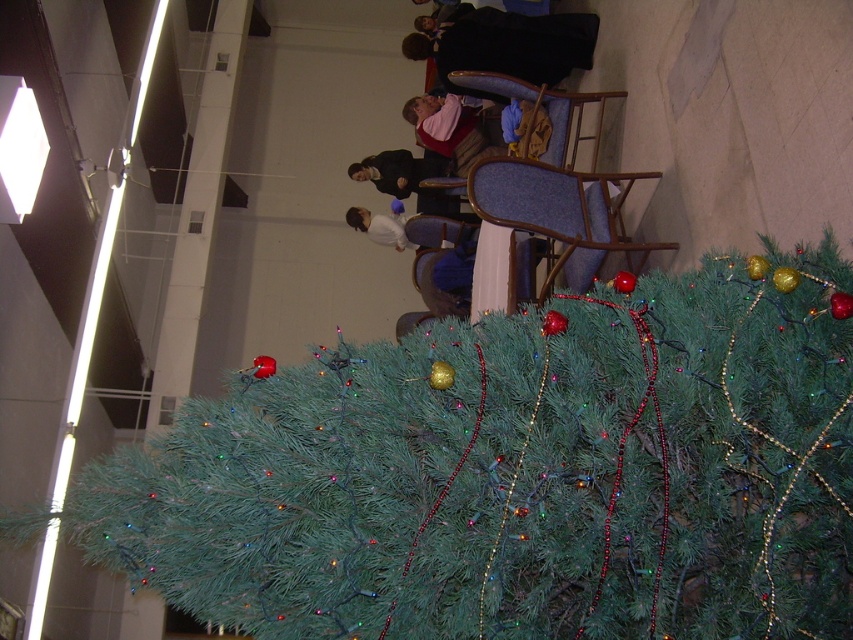
Question: Among these points, which one is nearest to the camera?

Choices:
 (A) (468, 148)
 (B) (340, 556)

Answer: (B)

Question: Among these objects, which one is nearest to the camera?

Choices:
 (A) green artificial christmas tree at center
 (B) white matte shirt at upper center
 (C) pink fabric shirt at upper center

Answer: (A)

Question: Based on their relative distances, which object is farther from the white matte shirt at upper center?

Choices:
 (A) green artificial christmas tree at center
 (B) pink fabric shirt at upper center

Answer: (A)

Question: Can you confirm if green artificial christmas tree at center is smaller than white matte shirt at upper center?

Choices:
 (A) no
 (B) yes

Answer: (A)

Question: Is green artificial christmas tree at center smaller than white matte shirt at upper center?

Choices:
 (A) yes
 (B) no

Answer: (B)

Question: Is green artificial christmas tree at center smaller than pink fabric shirt at upper center?

Choices:
 (A) no
 (B) yes

Answer: (A)